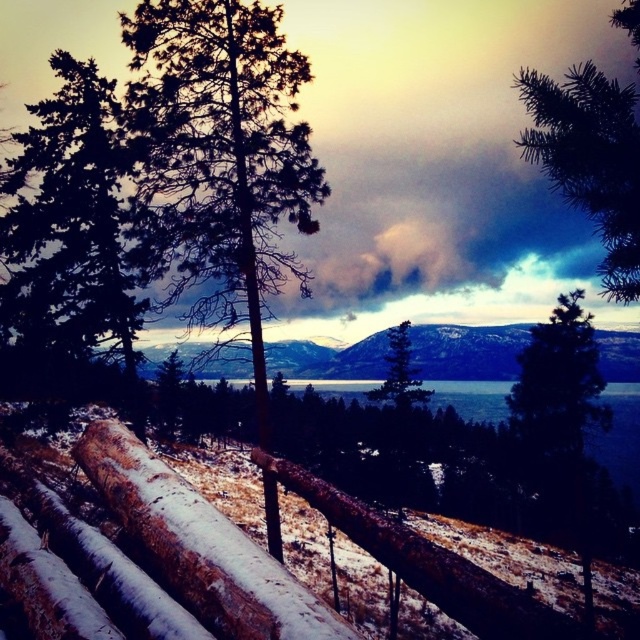
Who is more forward, (129, 484) or (572, 132)?

Positioned in front is point (572, 132).

Can you confirm if slightly glossy brown log at center is positioned to the right of green needle-like branches at upper right?

No, slightly glossy brown log at center is not to the right of green needle-like branches at upper right.

The height and width of the screenshot is (640, 640). Describe the element at coordinates (198, 545) in the screenshot. I see `slightly glossy brown log at center` at that location.

The image size is (640, 640). I want to click on slightly glossy brown log at center, so click(198, 545).

From the picture: Is slightly glossy brown log at center smaller than green matte tree at center?

Correct, slightly glossy brown log at center occupies less space than green matte tree at center.

Does slightly glossy brown log at center lie behind green matte tree at center?

No, it is not.

Measure the distance between point (317, 609) and camera.

Point (317, 609) is 3.89 meters from camera.

This screenshot has width=640, height=640. Identify the location of slightly glossy brown log at center. (198, 545).

Is green needle-like branches at upper right above green matte tree at center?

Indeed, green needle-like branches at upper right is positioned over green matte tree at center.

Which is more to the left, green needle-like branches at upper right or green matte tree at center?

From the viewer's perspective, green matte tree at center appears more on the left side.

Who is more forward, (596, 77) or (397, 339)?

Point (596, 77) is in front.

The height and width of the screenshot is (640, 640). Find the location of `green needle-like branches at upper right`. green needle-like branches at upper right is located at coordinates (589, 160).